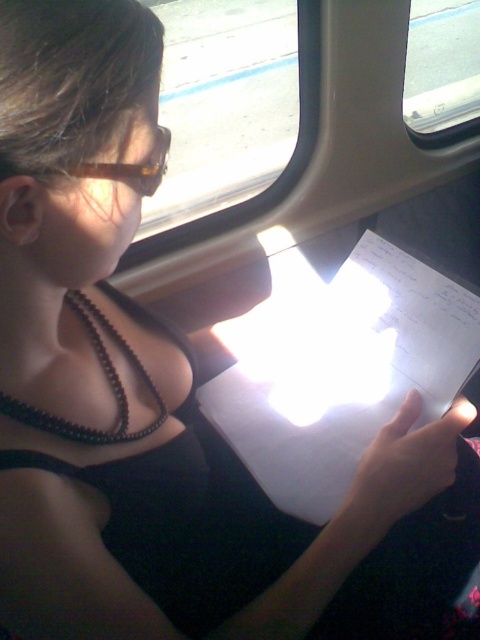
Identify the location of white paper at center. (338, 371).

Locate an element on the screen. white paper at center is located at coordinates pos(338,371).

Does black beaded necklace at center have a greater height compared to brown translucent goggles at upper left?

Yes.

Can you confirm if black beaded necklace at center is shorter than brown translucent goggles at upper left?

No, black beaded necklace at center is not shorter than brown translucent goggles at upper left.

Describe the element at coordinates (108, 381) in the screenshot. I see `black beaded necklace at center` at that location.

Find the location of a particular element. Image resolution: width=480 pixels, height=640 pixels. black beaded necklace at center is located at coordinates (108, 381).

Could you measure the distance between transparent glass train window at upper center and black beaded necklace at center?

A distance of 6.46 meters exists between transparent glass train window at upper center and black beaded necklace at center.

Where is `transparent glass train window at upper center`? This screenshot has width=480, height=640. transparent glass train window at upper center is located at coordinates (442, 70).